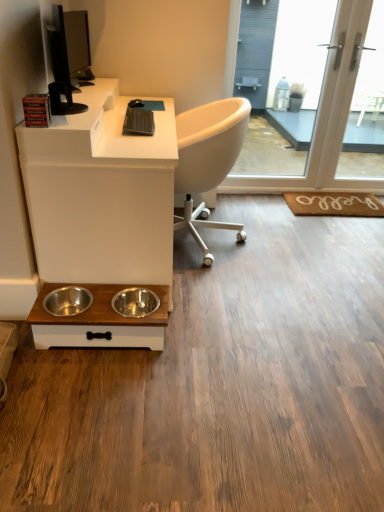
Question: Considering the relative sizes of white matte desk at lower left and black glossy monitor at upper left in the image provided, is white matte desk at lower left shorter than black glossy monitor at upper left?

Choices:
 (A) no
 (B) yes

Answer: (A)

Question: Could you tell me if white matte desk at lower left is turned towards black glossy monitor at upper left?

Choices:
 (A) yes
 (B) no

Answer: (B)

Question: From the image's perspective, is white matte desk at lower left located above black glossy monitor at upper left?

Choices:
 (A) no
 (B) yes

Answer: (A)

Question: Can you confirm if white matte desk at lower left is wider than black glossy monitor at upper left?

Choices:
 (A) no
 (B) yes

Answer: (B)

Question: Can you see white matte desk at lower left touching black glossy monitor at upper left?

Choices:
 (A) yes
 (B) no

Answer: (B)

Question: Is white glass screen door at upper right, which ranks as the second screen door in left-to-right order, in front of or behind white matte desk at lower left in the image?

Choices:
 (A) front
 (B) behind

Answer: (B)

Question: In terms of width, does white glass screen door at upper right, the first screen door from the right, look wider or thinner when compared to white matte desk at lower left?

Choices:
 (A) wide
 (B) thin

Answer: (B)

Question: Considering the positions of point (340, 163) and point (74, 237), is point (340, 163) closer or farther from the camera than point (74, 237)?

Choices:
 (A) farther
 (B) closer

Answer: (A)

Question: Is white glass screen door at upper right, the first screen door from the right, bigger or smaller than white matte desk at lower left?

Choices:
 (A) big
 (B) small

Answer: (B)

Question: Is point (84, 41) positioned closer to the camera than point (114, 103)?

Choices:
 (A) closer
 (B) farther

Answer: (B)

Question: From the image's perspective, is black glossy monitor at upper left positioned above or below white matte desk at lower left?

Choices:
 (A) below
 (B) above

Answer: (B)

Question: In terms of size, does black glossy monitor at upper left appear bigger or smaller than white matte desk at lower left?

Choices:
 (A) small
 (B) big

Answer: (A)

Question: From a real-world perspective, is black glossy monitor at upper left physically located above or below white matte desk at lower left?

Choices:
 (A) below
 (B) above

Answer: (B)

Question: From a real-world perspective, relative to black glossy monitor at upper left, is stainless steel bowls at lower center vertically above or below?

Choices:
 (A) above
 (B) below

Answer: (B)

Question: Would you say stainless steel bowls at lower center is to the left or to the right of black glossy monitor at upper left in the picture?

Choices:
 (A) left
 (B) right

Answer: (B)